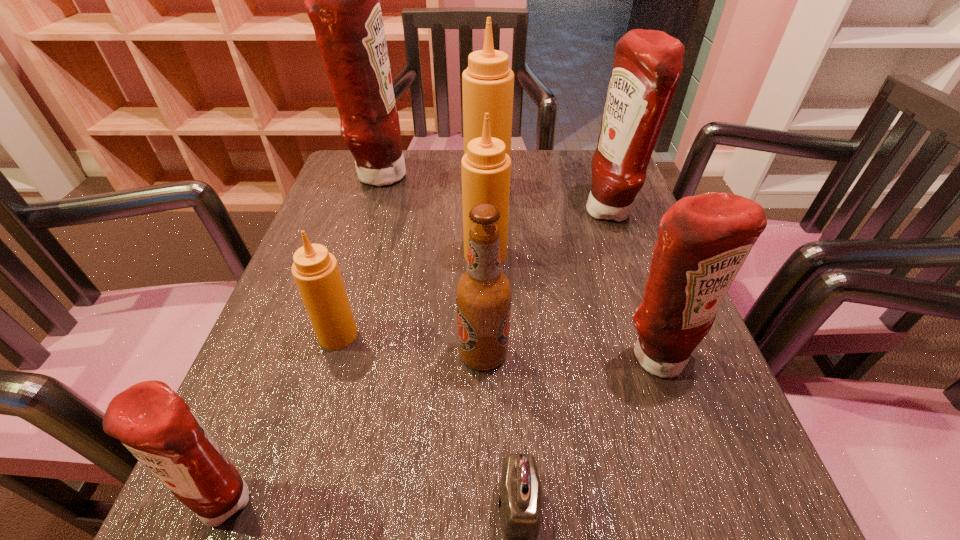
Find the location of a particular element. object that stands as the seventh closest to the nearest red condiment is located at coordinates (488, 83).

Where is `the eighth closest object to the second biggest red condiment`? The image size is (960, 540). the eighth closest object to the second biggest red condiment is located at coordinates (156, 425).

Where is `condiment that is the third closest to the sixth nearest object`? This screenshot has height=540, width=960. condiment that is the third closest to the sixth nearest object is located at coordinates (316, 272).

Select which condiment is the sixth closest to the padlock. Please provide its 2D coordinates. Your answer should be formatted as a tuple, i.e. [(x, y)], where the tuple contains the x and y coordinates of a point satisfying the conditions above.

[(488, 83)]

Choose which red condiment is the third nearest neighbor to the beer bottle. Please provide its 2D coordinates. Your answer should be formatted as a tuple, i.e. [(x, y)], where the tuple contains the x and y coordinates of a point satisfying the conditions above.

[(647, 65)]

Select which red condiment is the third closest to the fourth farthest condiment. Please provide its 2D coordinates. Your answer should be formatted as a tuple, i.e. [(x, y)], where the tuple contains the x and y coordinates of a point satisfying the conditions above.

[(704, 240)]

At what (x,y) coordinates should I click in order to perform the action: click on tan condiment identified as the second closest to the second biggest red condiment. Please return your answer as a coordinate pair (x, y). The width and height of the screenshot is (960, 540). Looking at the image, I should click on coord(486,168).

Locate an element on the screen. The width and height of the screenshot is (960, 540). the closest tan condiment relative to the farthest tan condiment is located at coordinates (486, 168).

Image resolution: width=960 pixels, height=540 pixels. I want to click on vacant area that satisfies the following two spatial constraints: 1. on the front label of the beer bottle; 2. on the front side of the smallest red condiment, so click(x=484, y=497).

The image size is (960, 540). I want to click on vacant space that satisfies the following two spatial constraints: 1. on the front side of the tallest condiment; 2. on the left side of the fourth farthest condiment, so click(354, 255).